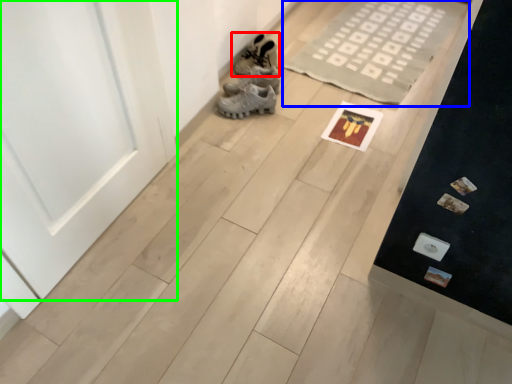
Question: Based on their relative distances, which object is nearer to footwear (highlighted by a red box)? Choose from doormat (highlighted by a blue box) and door (highlighted by a green box).

Choices:
 (A) doormat
 (B) door

Answer: (A)